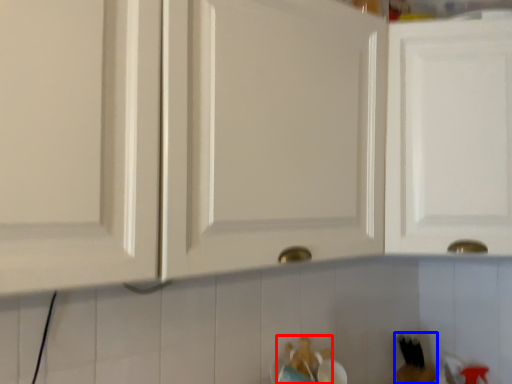
Question: Which object is closer to the camera taking this photo, toy (highlighted by a red box) or toy (highlighted by a blue box)?

Choices:
 (A) toy
 (B) toy

Answer: (A)